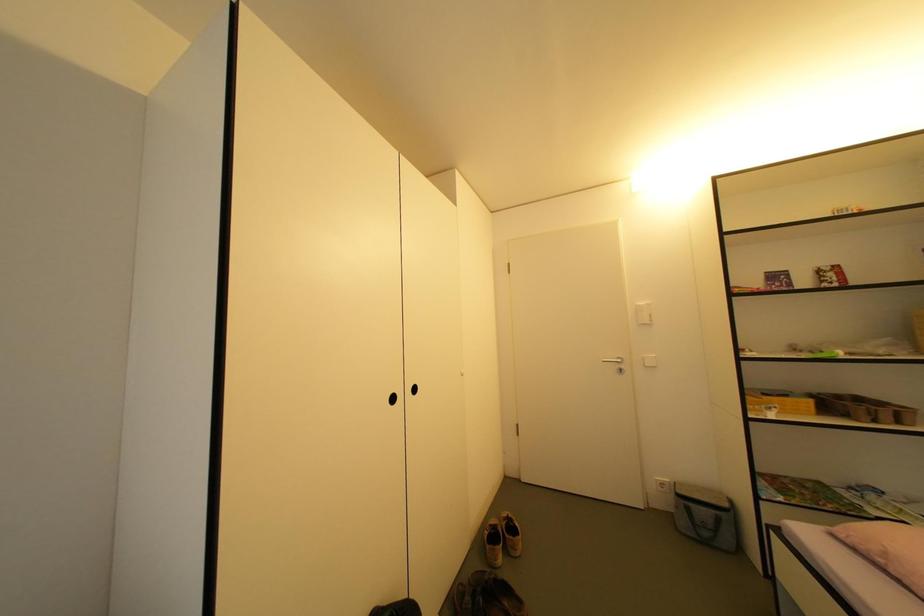
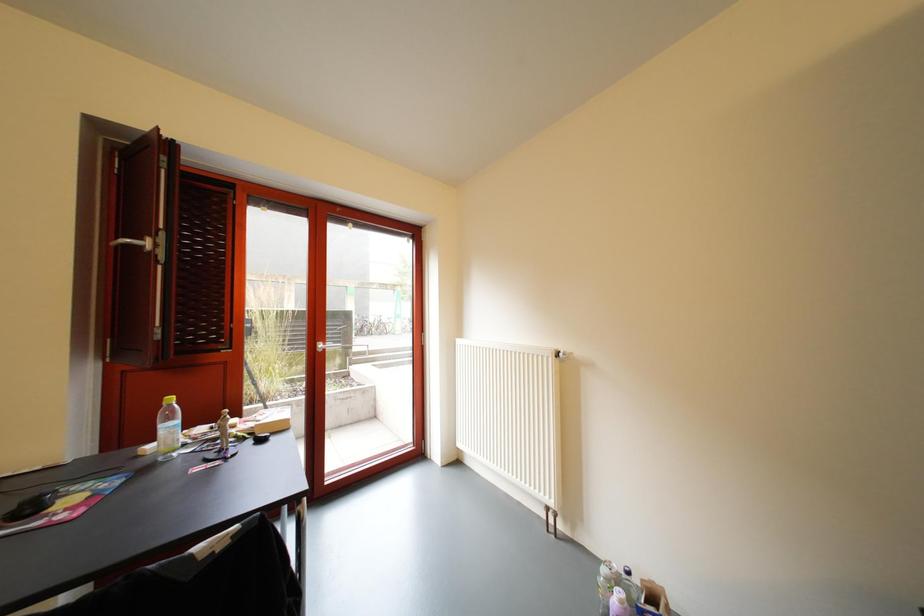
Question: The camera is either moving clockwise (left) or counter-clockwise (right) around the object. The first image is from the beginning of the video and the second image is from the end. Is the camera moving left or right when shooting the video?

Choices:
 (A) Left
 (B) Right

Answer: (B)